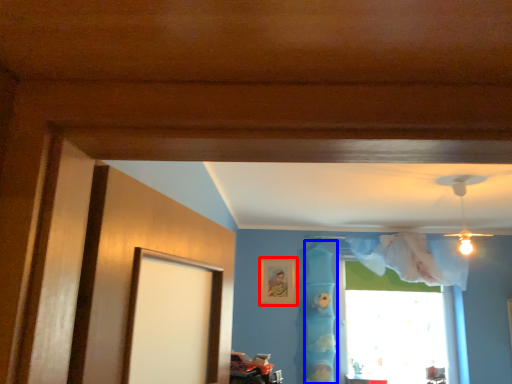
Question: Which point is closer to the camera, picture frame (highlighted by a red box) or curtain (highlighted by a blue box)?

Choices:
 (A) picture frame
 (B) curtain

Answer: (B)